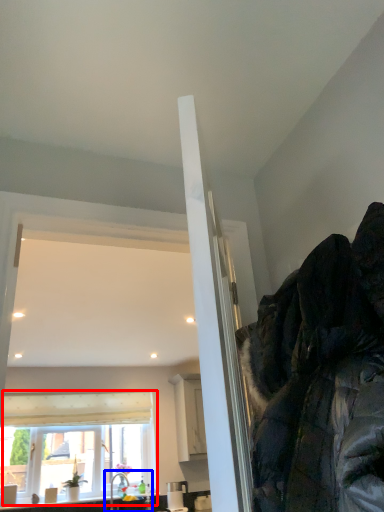
Question: Which object appears farthest to the camera in this image, window (highlighted by a red box) or sink (highlighted by a blue box)?

Choices:
 (A) window
 (B) sink

Answer: (A)